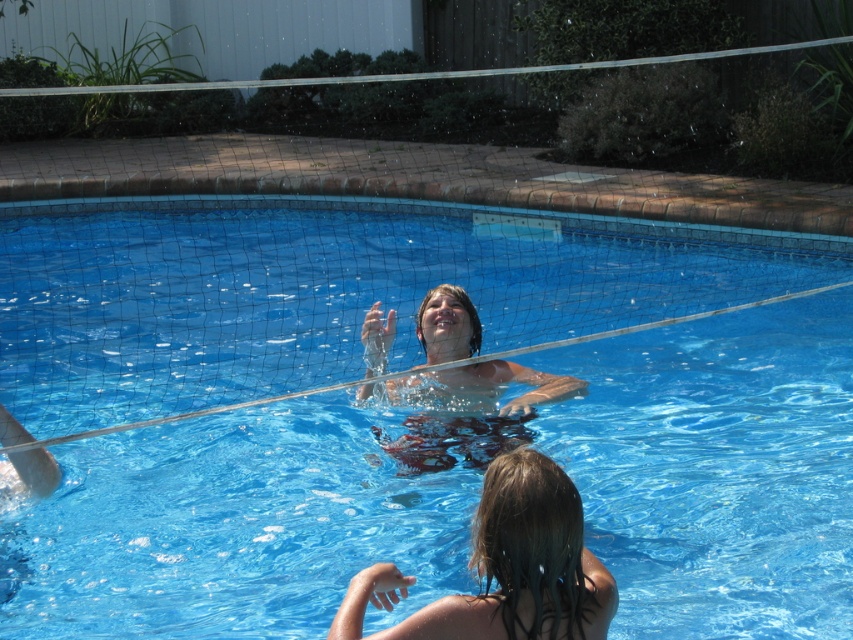
Question: Can you confirm if transparent blue water at center is positioned to the left of wet hair at lower center?

Choices:
 (A) yes
 (B) no

Answer: (A)

Question: Which point is closer to the camera?

Choices:
 (A) (363, 218)
 (B) (479, 556)

Answer: (B)

Question: Among these objects, which one is farthest from the camera?

Choices:
 (A) wet hair at lower center
 (B) transparent blue water at center

Answer: (B)

Question: Considering the relative positions of transparent blue water at center and wet hair at lower center in the image provided, where is transparent blue water at center located with respect to wet hair at lower center?

Choices:
 (A) left
 (B) right

Answer: (A)

Question: Is transparent blue water at center positioned before wet hair at lower center?

Choices:
 (A) yes
 (B) no

Answer: (B)